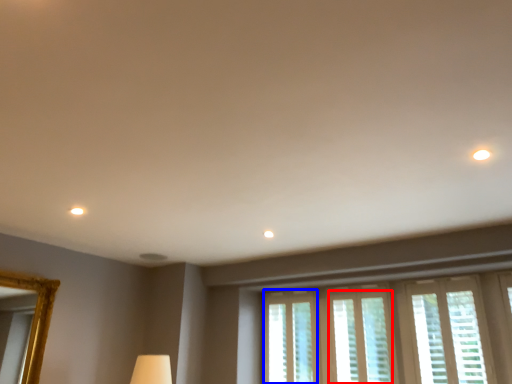
Question: Which of the following is the closest to the observer, window (highlighted by a red box) or window (highlighted by a blue box)?

Choices:
 (A) window
 (B) window

Answer: (A)